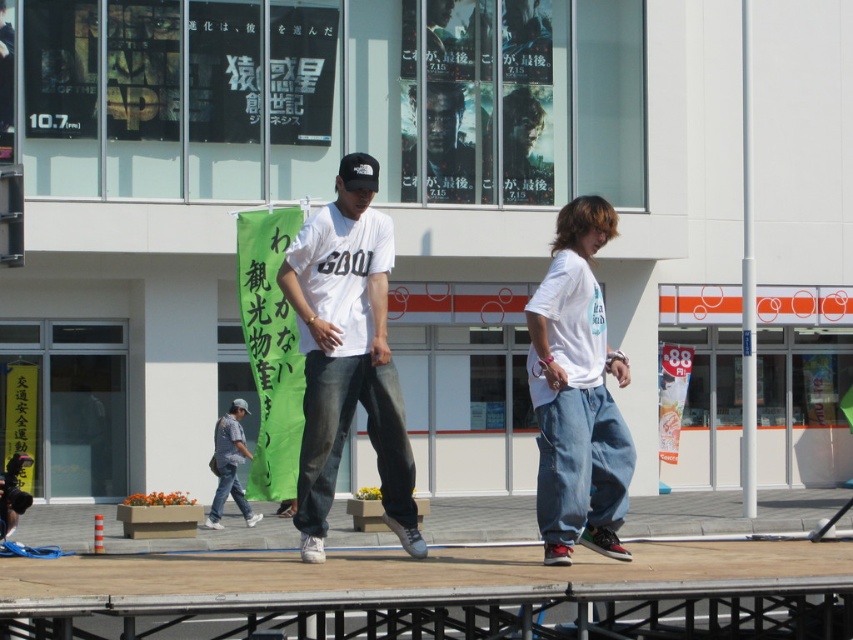
Is white matte t-shirt at center in front of denim pants at center?

No.

Can you confirm if white matte t-shirt at center is wider than denim pants at center?

No, white matte t-shirt at center is not wider than denim pants at center.

Is point (343, 317) farther from viewer compared to point (558, 465)?

Yes.

Identify the location of white matte t-shirt at center. (347, 355).